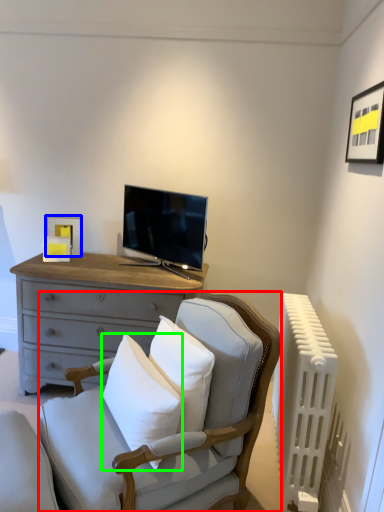
Question: Based on their relative distances, which object is nearer to rocking chair (highlighted by a red box)? Choose from picture frame (highlighted by a blue box) and pillow (highlighted by a green box).

Choices:
 (A) picture frame
 (B) pillow

Answer: (B)